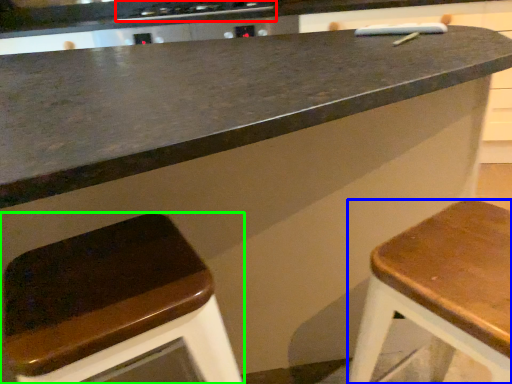
Question: Which is farther away from stove (highlighted by a red box)? stool (highlighted by a blue box) or stool (highlighted by a green box)?

Choices:
 (A) stool
 (B) stool

Answer: (A)